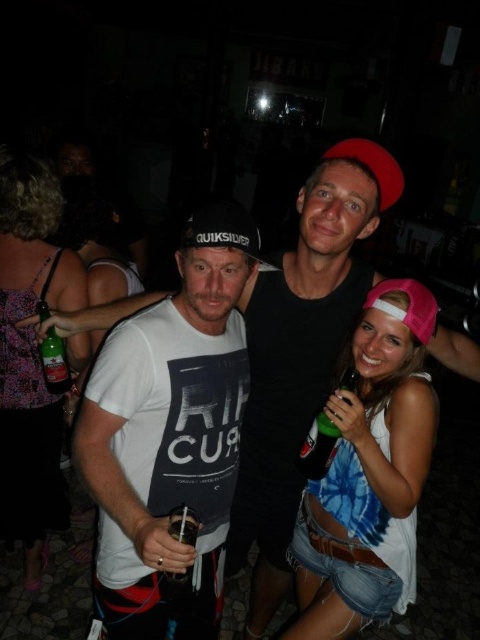
Question: Which of the following is the farthest from the observer?

Choices:
 (A) (312, 460)
 (B) (175, 573)
 (C) (235, 550)
 (D) (322, 614)

Answer: (C)

Question: Which object is closer to the camera taking this photo?

Choices:
 (A) white matte t-shirt at center
 (B) green glass bottle at left
 (C) clear plastic cup at center

Answer: (A)

Question: Observing the image, what is the correct spatial positioning of white matte t-shirt at center in reference to white cotton t-shirt at center?

Choices:
 (A) right
 (B) left

Answer: (B)

Question: Is tie-dye fabric tank top at center bigger than printed fabric dress at left?

Choices:
 (A) no
 (B) yes

Answer: (A)

Question: Considering the relative positions of white matte t-shirt at center and tie-dye fabric tank top at center in the image provided, where is white matte t-shirt at center located with respect to tie-dye fabric tank top at center?

Choices:
 (A) below
 (B) above

Answer: (B)

Question: Which object is positioned farthest from the clear plastic cup at center?

Choices:
 (A) green glass bottle at left
 (B) tie-dye fabric tank top at center
 (C) printed fabric dress at left
 (D) white cotton t-shirt at center

Answer: (C)